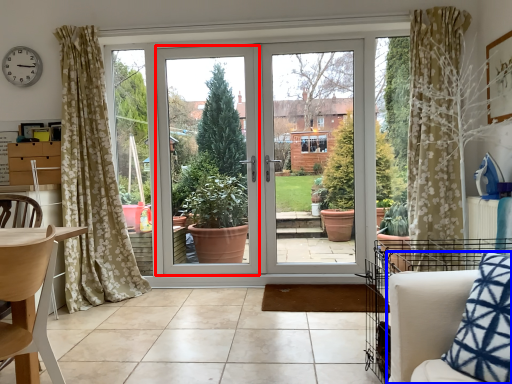
Question: Which point is further to the camera, window frame (highlighted by a red box) or armchair (highlighted by a blue box)?

Choices:
 (A) window frame
 (B) armchair

Answer: (A)